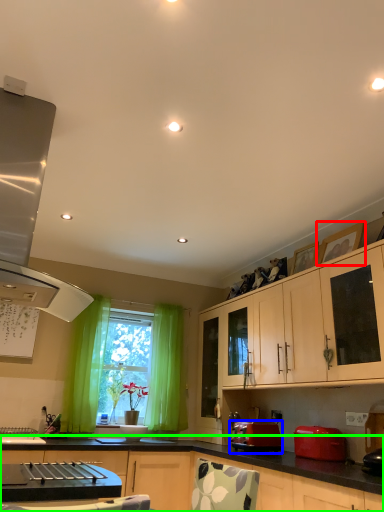
Question: Which object is positioned closest to picture frame (highlighted by a red box)? Select from toaster (highlighted by a blue box) and cabinetry (highlighted by a green box).

Choices:
 (A) toaster
 (B) cabinetry

Answer: (A)